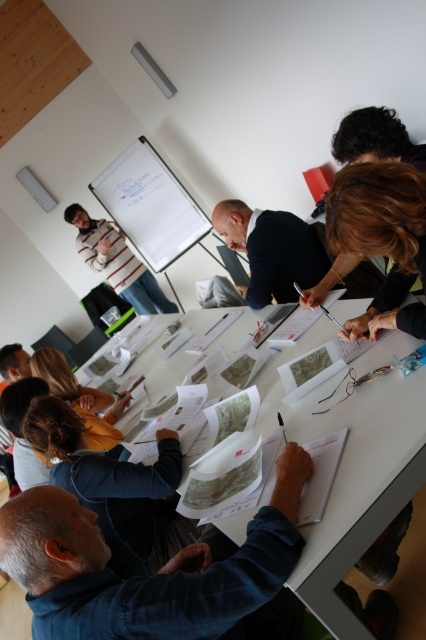
You are organizing a photo shoot and need to place two mannequins wearing the dark blue suit at center and the striped cotton shirt at upper left. Which mannequin should be placed closer to the camera to maintain the same visual size as the other?

The dark blue suit at center has a lesser width compared to the striped cotton shirt at upper left. To maintain the same visual size, the dark blue suit at center should be placed closer to the camera than the striped cotton shirt at upper left.

You are attending a meeting and need to present your idea to the group. You are standing near the white paper at center and the dark blue suit at center. Which object is closer to you?

The white paper at center is positioned under dark blue suit at center, so the dark blue suit at center is closer to you.